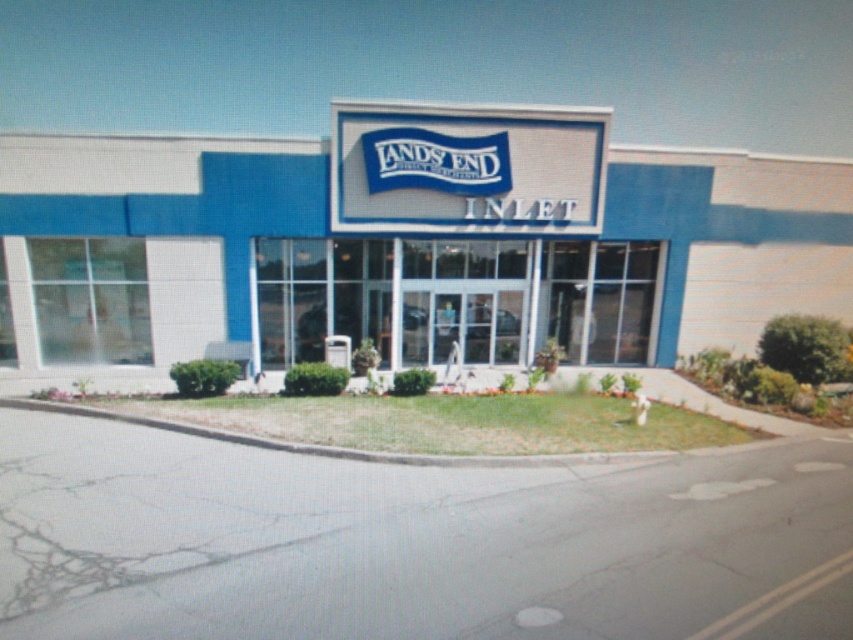
Question: Considering the relative positions of white textured building at center and transparent glass storefront at center in the image provided, where is white textured building at center located with respect to transparent glass storefront at center?

Choices:
 (A) below
 (B) above

Answer: (B)

Question: Among these points, which one is nearest to the camera?

Choices:
 (A) (90, 328)
 (B) (531, 317)

Answer: (A)

Question: Among these objects, which one is nearest to the camera?

Choices:
 (A) transparent glass storefront at center
 (B) white textured building at center

Answer: (B)

Question: Where is white textured building at center located in relation to transparent glass storefront at center in the image?

Choices:
 (A) below
 (B) above

Answer: (B)

Question: Is white textured building at center closer to the viewer compared to transparent glass storefront at center?

Choices:
 (A) no
 (B) yes

Answer: (B)